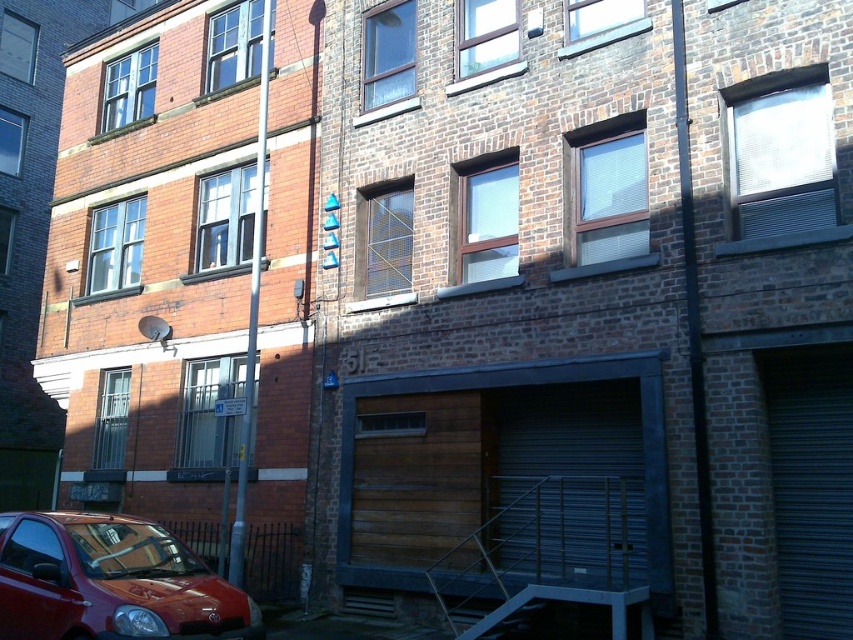
Does dark gray metallic garage door at lower right have a lesser width compared to wooden garage door at lower center?

Yes, dark gray metallic garage door at lower right is thinner than wooden garage door at lower center.

Where is `dark gray metallic garage door at lower right`? This screenshot has width=853, height=640. dark gray metallic garage door at lower right is located at coordinates (811, 486).

This screenshot has height=640, width=853. Find the location of `metallic gray garage door at lower center`. metallic gray garage door at lower center is located at coordinates (x=572, y=477).

Is metallic gray garage door at lower center to the right of dark gray metallic garage door at lower right from the viewer's perspective?

Incorrect, metallic gray garage door at lower center is not on the right side of dark gray metallic garage door at lower right.

Which is in front, point (544, 564) or point (840, 484)?

Point (840, 484) is in front.

The height and width of the screenshot is (640, 853). Find the location of `metallic gray garage door at lower center`. metallic gray garage door at lower center is located at coordinates (572, 477).

Is shiny red car at lower left to the right of dark gray metallic garage door at lower right from the viewer's perspective?

Incorrect, shiny red car at lower left is not on the right side of dark gray metallic garage door at lower right.

Describe the element at coordinates (111, 582) in the screenshot. Image resolution: width=853 pixels, height=640 pixels. I see `shiny red car at lower left` at that location.

You are a GUI agent. You are given a task and a screenshot of the screen. Output one action in this format:
    pyautogui.click(x=<x>, y=<y>)
    Task: Click on the shiny red car at lower left
    This screenshot has height=640, width=853.
    Given the screenshot: What is the action you would take?
    pyautogui.click(x=111, y=582)